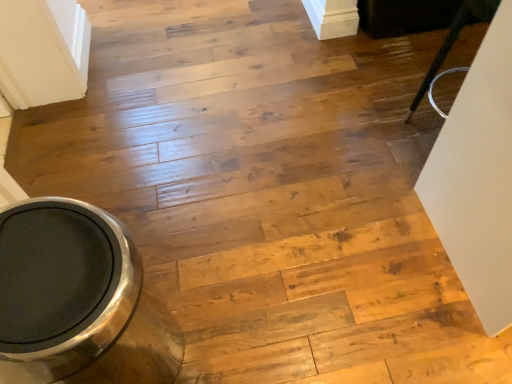
Identify the location of unoccupied space behind polished stainless steel toilet bowl at lower left. The height and width of the screenshot is (384, 512). (176, 250).